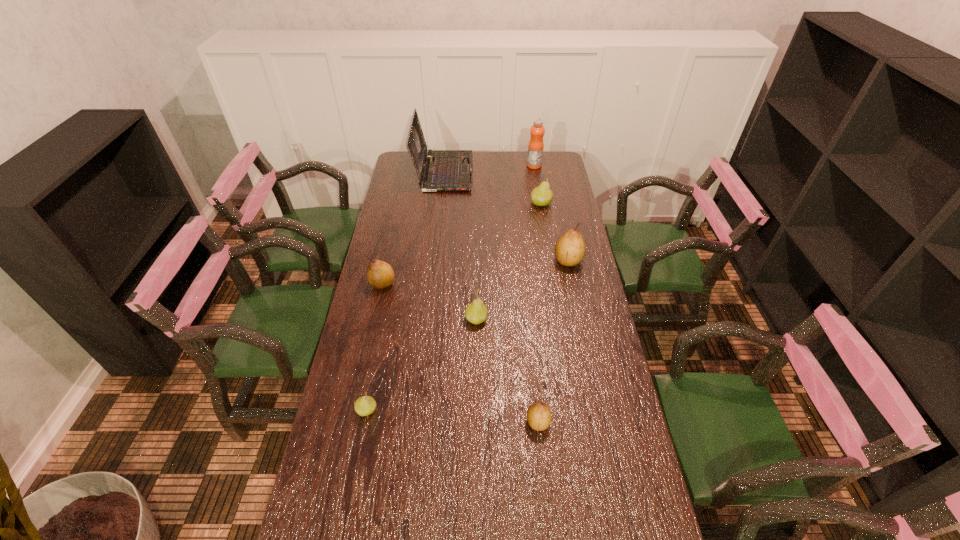
Find the location of `the second brown pear from right to left`. the second brown pear from right to left is located at coordinates (539, 416).

Locate an element on the screen. The width and height of the screenshot is (960, 540). the nearest brown pear is located at coordinates (539, 416).

You are a GUI agent. You are given a task and a screenshot of the screen. Output one action in this format:
    pyautogui.click(x=<x>, y=<y>)
    Task: Click on the nearest green pear
    Image resolution: width=960 pixels, height=540 pixels.
    Given the screenshot: What is the action you would take?
    pyautogui.click(x=365, y=405)

Find the location of a particular element. the smallest green pear is located at coordinates (365, 405).

Where is `free space located 0.270m on the screen of the laptop computer`? free space located 0.270m on the screen of the laptop computer is located at coordinates (526, 172).

The image size is (960, 540). Find the location of `free location located 0.300m on the front of the fruit juice`. free location located 0.300m on the front of the fruit juice is located at coordinates (540, 205).

Where is `vacant space situated 0.340m on the front of the third farthest object`? The image size is (960, 540). vacant space situated 0.340m on the front of the third farthest object is located at coordinates (551, 261).

You are a GUI agent. You are given a task and a screenshot of the screen. Output one action in this format:
    pyautogui.click(x=<x>, y=<y>)
    Task: Click on the free space located 0.130m on the back of the rightmost brown pear
    
    Given the screenshot: What is the action you would take?
    pyautogui.click(x=562, y=230)

You are a GUI agent. You are given a task and a screenshot of the screen. Output one action in this format:
    pyautogui.click(x=<x>, y=<y>)
    Task: Click on the vacant space situated on the front of the second nearest brown pear
    
    Given the screenshot: What is the action you would take?
    (361, 383)

Where is `vacant area located 0.230m on the front of the second green pear from right to left`? vacant area located 0.230m on the front of the second green pear from right to left is located at coordinates (x=476, y=388).